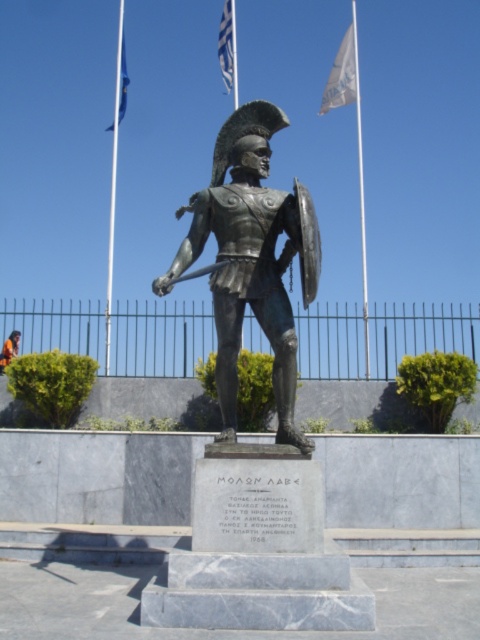
Question: Is white fabric flagpole at upper center above blue fabric flag at upper left?

Choices:
 (A) no
 (B) yes

Answer: (A)

Question: Which object appears closest to the camera in this image?

Choices:
 (A) white flagpole at upper left
 (B) orange fabric at lower left
 (C) bronze statue at center

Answer: (C)

Question: Does bronze statue at center have a larger size compared to blue fabric flag at upper left?

Choices:
 (A) no
 (B) yes

Answer: (A)

Question: Which of the following is the closest to the observer?

Choices:
 (A) white fabric flagpole at upper center
 (B) white fabric flag at upper center

Answer: (A)

Question: Can you confirm if white flagpole at upper left is smaller than white fabric flag at upper center?

Choices:
 (A) no
 (B) yes

Answer: (A)

Question: Which of these objects is positioned farthest from the blue fabric flag at upper center?

Choices:
 (A) blue fabric flag at upper left
 (B) white flagpole at upper left

Answer: (B)